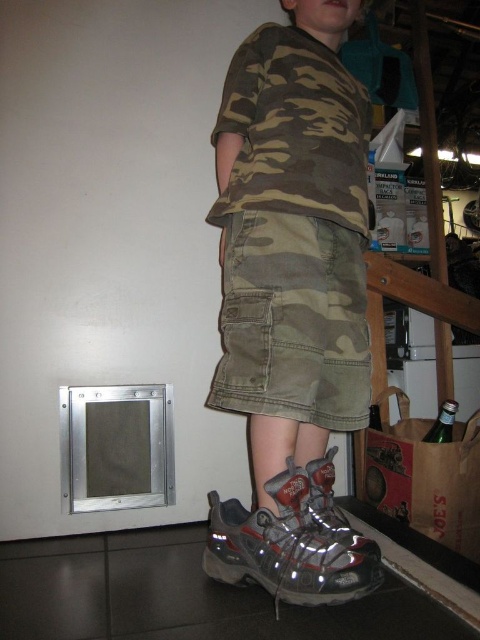
You are a delivery person who needs to place a box on the floor between the camouflage fabric shirt at center and the pet door on the left. The box is 1 meter long. Can you fit it there?

The distance between the camouflage fabric shirt at center and the pet door on the left is 95.21 centimeters. Since the box is 1 meter long, it won not fit in the available space.

You are a photographer setting up a shoot in this basement. You want to ensure that both the camouflage fabric shirt at center and the metallic gray shoe at lower center are clearly visible in your photo. Based on their positions, which object will appear larger in the final image?

The camouflage fabric shirt at center will appear larger in the final image because it is closer to the viewer than the metallic gray shoe at lower center, making it appear bigger due to perspective.

You are a fashion designer observing the image. You need to determine which item is higher in height between the camouflage fabric shirt at center and the metallic gray shoe at lower center. Which one is taller?

The camouflage fabric shirt at center is much taller as metallic gray shoe at lower center.